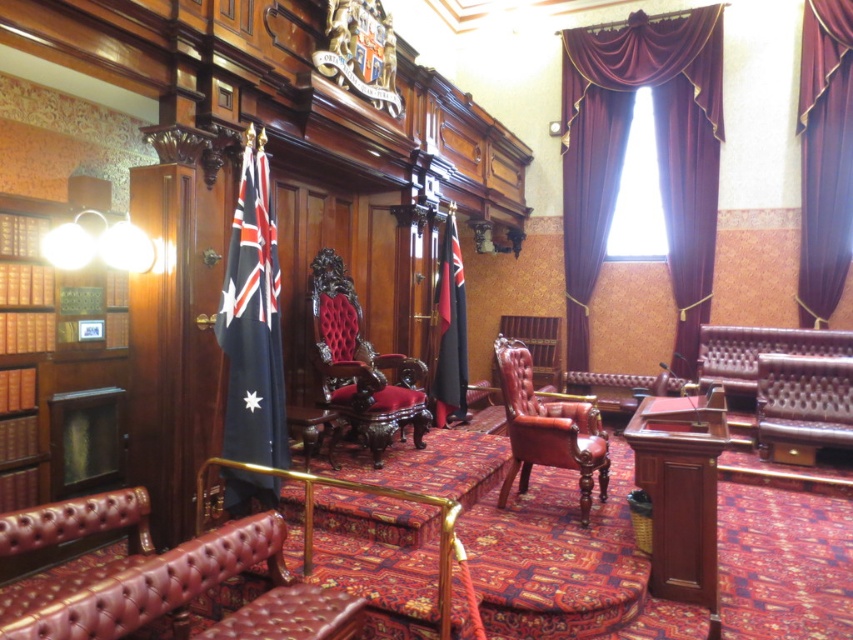
Question: From the image, what is the correct spatial relationship of leather tufted chair at center in relation to velvet curtain at center?

Choices:
 (A) below
 (B) above

Answer: (A)

Question: Which object is the farthest from the blue fabric flag at left?

Choices:
 (A) velvet curtain at center
 (B) leather armchair at center
 (C) velvet drapery at upper right

Answer: (A)

Question: Which point appears closest to the camera in this image?

Choices:
 (A) (x=378, y=372)
 (B) (x=786, y=381)
 (C) (x=825, y=300)

Answer: (A)

Question: Which point is closer to the camera?

Choices:
 (A) velvet drapery at upper right
 (B) black fabric flag at center
 (C) leather tufted chair at center

Answer: (C)

Question: Is blue fabric flag at left below black fabric flag at center?

Choices:
 (A) yes
 (B) no

Answer: (A)

Question: Does velvet red armchair at center appear over leather tufted armchair at right?

Choices:
 (A) yes
 (B) no

Answer: (A)